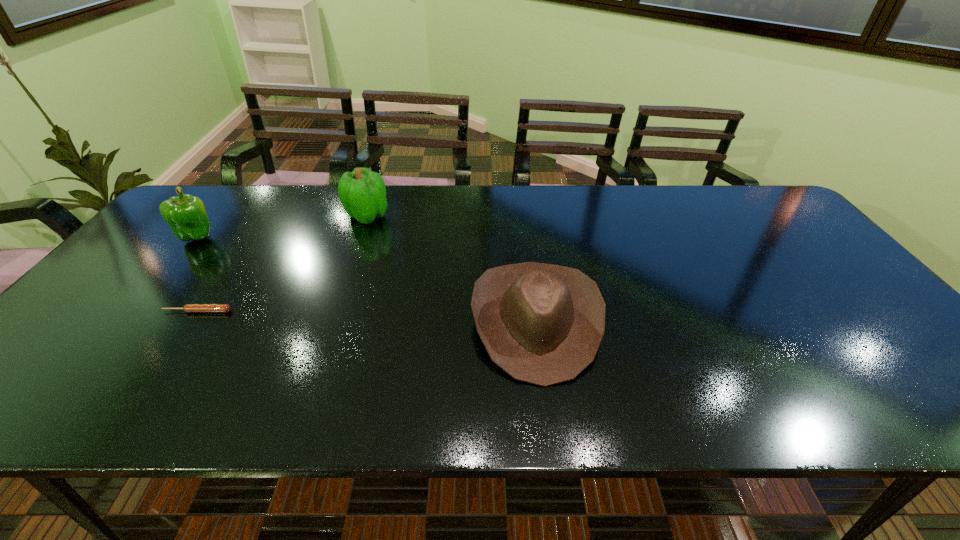
Find the location of `the leftmost object`. the leftmost object is located at coordinates (186, 215).

This screenshot has width=960, height=540. I want to click on the second object from right to left, so click(362, 192).

The width and height of the screenshot is (960, 540). Identify the location of cowboy hat. (542, 324).

Locate an element on the screen. the second shortest object is located at coordinates (542, 324).

I want to click on the shortest object, so click(x=189, y=308).

Identify the location of the third object from right to left. (189, 308).

Find the location of a particular element. vacant space located on the right of the left bell pepper is located at coordinates (302, 237).

Where is `free space located 0.310m on the left of the right bell pepper`? free space located 0.310m on the left of the right bell pepper is located at coordinates 247,215.

At what (x,y) coordinates should I click in order to perform the action: click on vacant area situated on the right of the rightmost object. Please return your answer as a coordinate pair (x, y). The height and width of the screenshot is (540, 960). Looking at the image, I should click on (739, 321).

You are a GUI agent. You are given a task and a screenshot of the screen. Output one action in this format:
    pyautogui.click(x=<x>, y=<y>)
    Task: Click on the free space located 0.160m on the front of the shortest object
    The width and height of the screenshot is (960, 540).
    Given the screenshot: What is the action you would take?
    pyautogui.click(x=159, y=368)